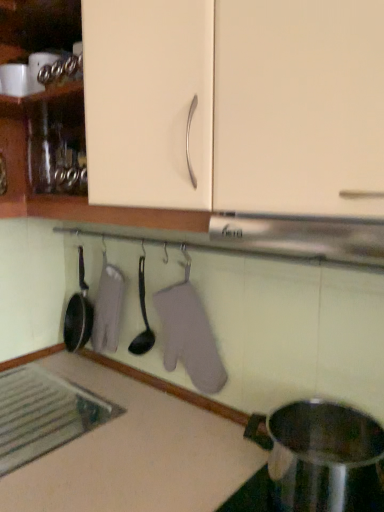
I want to click on black plastic spoon at center, so coord(143,319).

Where is `stainless steel pot at lower right`? stainless steel pot at lower right is located at coordinates (322, 457).

The height and width of the screenshot is (512, 384). What are the coordinates of `gray fabric oven mitt at center` in the screenshot? It's located at (189, 334).

Which object is closer to the camera taking this photo, gray fabric oven mitt at center or matte cream cabinet at upper center?

Positioned in front is matte cream cabinet at upper center.

Considering the sizes of objects gray fabric oven mitt at center and matte cream cabinet at upper center in the image provided, who is smaller, gray fabric oven mitt at center or matte cream cabinet at upper center?

gray fabric oven mitt at center.

Consider the image. Which is nearer, (192,342) or (137,51)?

Point (192,342) is farther from the camera than point (137,51).

Is gray fabric oven mitt at center turned away from matte cream cabinet at upper center?

No, gray fabric oven mitt at center's orientation is not away from matte cream cabinet at upper center.

Considering the sizes of objects black plastic spoon at center and stainless steel pot at lower right in the image provided, who is thinner, black plastic spoon at center or stainless steel pot at lower right?

black plastic spoon at center.

From the image's perspective, is black plastic spoon at center located beneath stainless steel pot at lower right?

No.

In terms of size, does black plastic spoon at center appear bigger or smaller than stainless steel pot at lower right?

Clearly, black plastic spoon at center is smaller in size than stainless steel pot at lower right.

Consider the image. Can stainless steel pot at lower right be found inside black plastic spoon at center?

No, stainless steel pot at lower right is not a part of black plastic spoon at center.

Could you tell me if white matte countertop at lower left is turned towards gray fabric oven mitt at center?

No, white matte countertop at lower left is not facing towards gray fabric oven mitt at center.

Can you confirm if white matte countertop at lower left is positioned to the left of gray fabric oven mitt at center?

Correct, you'll find white matte countertop at lower left to the left of gray fabric oven mitt at center.

How different are the orientations of white matte countertop at lower left and gray fabric oven mitt at center in degrees?

white matte countertop at lower left and gray fabric oven mitt at center are facing 1.95 degrees away from each other.

Measure the distance from white matte countertop at lower left to gray fabric oven mitt at center.

A distance of 9.99 inches exists between white matte countertop at lower left and gray fabric oven mitt at center.

In the scene shown: From the image's perspective, which object appears higher, white matte countertop at lower left or matte cream cabinet at upper center?

From the image's view, matte cream cabinet at upper center is above.

Can you tell me how much white matte countertop at lower left and matte cream cabinet at upper center differ in facing direction?

The facing directions of white matte countertop at lower left and matte cream cabinet at upper center are 0.0156 degrees apart.

Between white matte countertop at lower left and matte cream cabinet at upper center, which one has smaller size?

white matte countertop at lower left is smaller.

Is point (142, 435) behind point (175, 3)?

Yes, point (142, 435) is behind point (175, 3).

How distant is stainless steel pot at lower right from white matte countertop at lower left?

8.39 inches.

What's the angular difference between stainless steel pot at lower right and white matte countertop at lower left's facing directions?

stainless steel pot at lower right and white matte countertop at lower left are facing 0.127 degrees away from each other.

What are the coordinates of `appliance behind the white matte countertop at lower left` in the screenshot? It's located at (322, 457).

Could you tell me if stainless steel pot at lower right is turned towards white matte countertop at lower left?

No, stainless steel pot at lower right is not oriented towards white matte countertop at lower left.

From the image's perspective, which one is positioned lower, stainless steel pot at lower right or black plastic spoon at center?

stainless steel pot at lower right appears lower in the image.

From a real-world perspective, relative to black plastic spoon at center, is stainless steel pot at lower right vertically above or below?

stainless steel pot at lower right is situated lower than black plastic spoon at center in the real world.

Looking at their sizes, would you say stainless steel pot at lower right is wider or thinner than black plastic spoon at center?

Clearly, stainless steel pot at lower right has more width compared to black plastic spoon at center.

Which is closer to the camera, [166,419] or [135,343]?

The point [166,419] is more forward.

What's the angular difference between white matte countertop at lower left and black plastic spoon at center's facing directions?

The facing directions of white matte countertop at lower left and black plastic spoon at center are 1.94 degrees apart.

Considering the relative sizes of white matte countertop at lower left and black plastic spoon at center in the image provided, is white matte countertop at lower left thinner than black plastic spoon at center?

In fact, white matte countertop at lower left might be wider than black plastic spoon at center.

In the image, there is a matte cream cabinet at upper center. Identify the location of laundry below it (from a real-world perspective). (189, 334).

Find the location of a particular element. Image resolution: width=384 pixels, height=512 pixels. appliance in front of the black plastic spoon at center is located at coordinates (322, 457).

Based on their spatial positions, is black plastic spoon at center or white matte countertop at lower left closer to gray fabric oven mitt at center?

black plastic spoon at center is positioned closer to the anchor gray fabric oven mitt at center.

Based on their spatial positions, is white matte countertop at lower left or black plastic spoon at center closer to matte cream cabinet at upper center?

Based on the image, black plastic spoon at center appears to be nearer to matte cream cabinet at upper center.

Considering their positions, is matte cream cabinet at upper center positioned closer to black plastic spoon at center than white matte countertop at lower left?

Based on the image, white matte countertop at lower left appears to be nearer to black plastic spoon at center.

Which object lies further to the anchor point matte cream cabinet at upper center, stainless steel pot at lower right or gray fabric oven mitt at center?

stainless steel pot at lower right.

Considering their positions, is gray fabric oven mitt at center positioned closer to white matte countertop at lower left than black plastic spoon at center?

Among the two, gray fabric oven mitt at center is located nearer to white matte countertop at lower left.

Which object lies further to the anchor point white matte countertop at lower left, stainless steel pot at lower right or black plastic spoon at center?

black plastic spoon at center.

Which object lies nearer to the anchor point gray fabric oven mitt at center, matte cream cabinet at upper center or white matte countertop at lower left?

white matte countertop at lower left lies closer to gray fabric oven mitt at center than the other object.

Considering their positions, is black plastic spoon at center positioned closer to matte cream cabinet at upper center than gray fabric oven mitt at center?

gray fabric oven mitt at center is closer to matte cream cabinet at upper center.

Locate an element on the screen. appliance between white matte countertop at lower left and gray fabric oven mitt at center along the z-axis is located at coordinates (322, 457).

Identify the location of spoon that lies between matte cream cabinet at upper center and white matte countertop at lower left from top to bottom. This screenshot has height=512, width=384. (143, 319).

At what (x,y) coordinates should I click in order to perform the action: click on appliance between matte cream cabinet at upper center and white matte countertop at lower left vertically. Please return your answer as a coordinate pair (x, y). The width and height of the screenshot is (384, 512). Looking at the image, I should click on (322, 457).

Identify the location of laundry between matte cream cabinet at upper center and white matte countertop at lower left vertically. This screenshot has height=512, width=384. (189, 334).